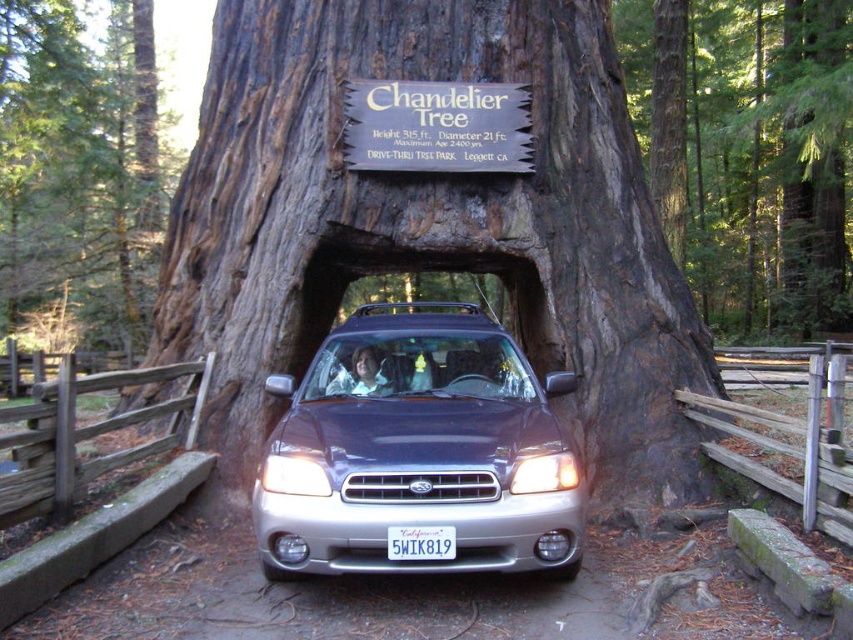
Which of these two, dark brown wood at center or white plastic license plate at center, stands taller?

dark brown wood at center is taller.

Based on the photo, is dark brown wood at center bigger than white plastic license plate at center?

Indeed, dark brown wood at center has a larger size compared to white plastic license plate at center.

The width and height of the screenshot is (853, 640). What are the coordinates of `dark brown wood at center` in the screenshot? It's located at (428, 225).

Is point (439, 467) closer to viewer compared to point (757, 192)?

Yes, point (439, 467) is in front of point (757, 192).

Is satin silver suv at center to the right of smooth bark tree at center from the viewer's perspective?

No, satin silver suv at center is not to the right of smooth bark tree at center.

The image size is (853, 640). I want to click on satin silver suv at center, so click(x=416, y=451).

Who is positioned more to the right, smooth bark tree at center or dark brown bark tree at center?

Positioned to the right is smooth bark tree at center.

Which is behind, point (838, 180) or point (148, 88)?

The point (148, 88) is behind.

Does point (672, 74) lie in front of point (135, 29)?

That is True.

This screenshot has width=853, height=640. Identify the location of smooth bark tree at center. (749, 150).